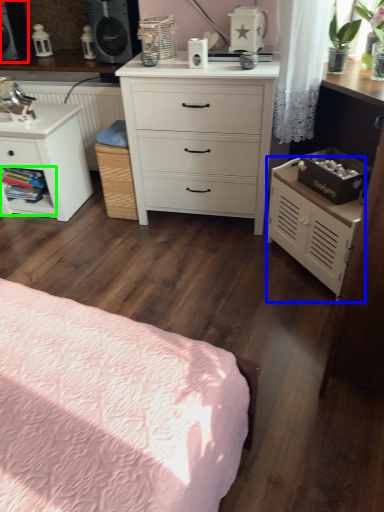
Question: Which is farther away from speaker (highlighted by a red box)? nightstand (highlighted by a blue box) or shelf (highlighted by a green box)?

Choices:
 (A) nightstand
 (B) shelf

Answer: (A)